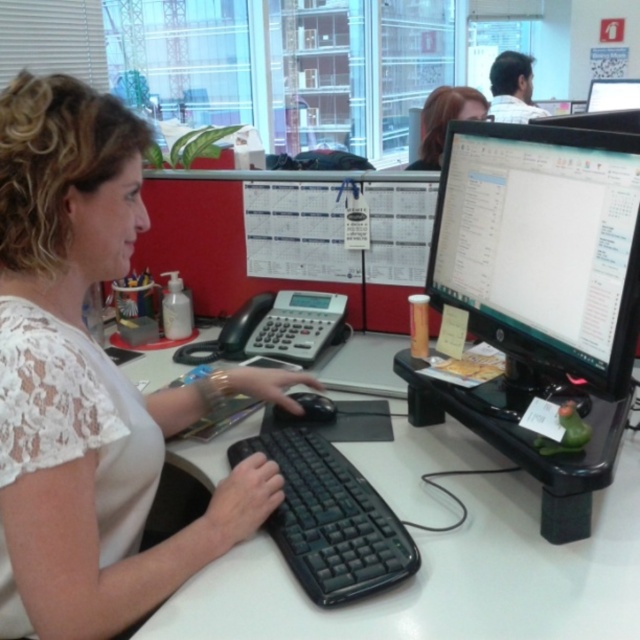
What do you see at coordinates (90, 381) in the screenshot? The height and width of the screenshot is (640, 640). I see `white lace blouse at center` at bounding box center [90, 381].

Does white lace blouse at center have a greater height compared to blonde hair at upper center?

Yes.

What do you see at coordinates (90, 381) in the screenshot? I see `white lace blouse at center` at bounding box center [90, 381].

I want to click on white lace blouse at center, so click(90, 381).

Can you confirm if black plastic keyboard at center is positioned below blonde hair at upper center?

Yes.

Is black plastic keyboard at center bigger than blonde hair at upper center?

Incorrect, black plastic keyboard at center is not larger than blonde hair at upper center.

Does point (385, 552) come in front of point (429, 125)?

Yes, point (385, 552) is closer to viewer.

Locate an element on the screen. This screenshot has height=640, width=640. black plastic keyboard at center is located at coordinates 330,518.

Measure the distance between matte black monitor at center and camera.

A distance of 32.70 inches exists between matte black monitor at center and camera.

Does matte black monitor at center appear under black matte mouse at center?

Actually, matte black monitor at center is above black matte mouse at center.

Who is more distant from viewer, (545,145) or (276,416)?

Positioned behind is point (276,416).

You are a GUI agent. You are given a task and a screenshot of the screen. Output one action in this format:
    pyautogui.click(x=<x>, y=<y>)
    Task: Click on the matte black monitor at center
    Image resolution: width=640 pixels, height=640 pixels.
    Given the screenshot: What is the action you would take?
    pyautogui.click(x=541, y=244)